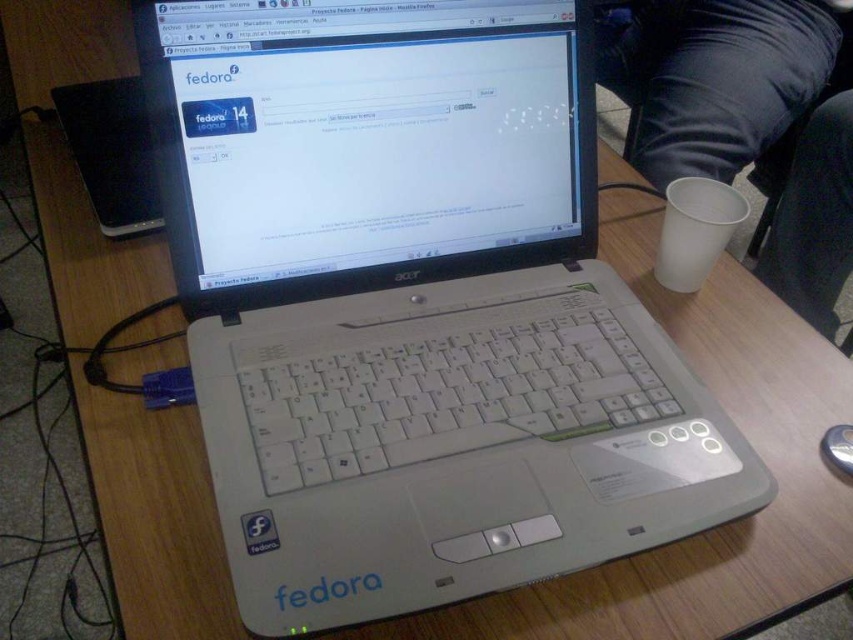
Can you confirm if black fabric lap at upper right is thinner than silver metallic mouse at lower right?

Incorrect, black fabric lap at upper right's width is not less than silver metallic mouse at lower right's.

Between black fabric lap at upper right and silver metallic mouse at lower right, which one appears on the right side from the viewer's perspective?

Positioned to the right is black fabric lap at upper right.

This screenshot has height=640, width=853. Find the location of `black fabric lap at upper right`. black fabric lap at upper right is located at coordinates (718, 77).

You are a GUI agent. You are given a task and a screenshot of the screen. Output one action in this format:
    pyautogui.click(x=<x>, y=<y>)
    Task: Click on the black fabric lap at upper right
    The width and height of the screenshot is (853, 640).
    Given the screenshot: What is the action you would take?
    pyautogui.click(x=718, y=77)